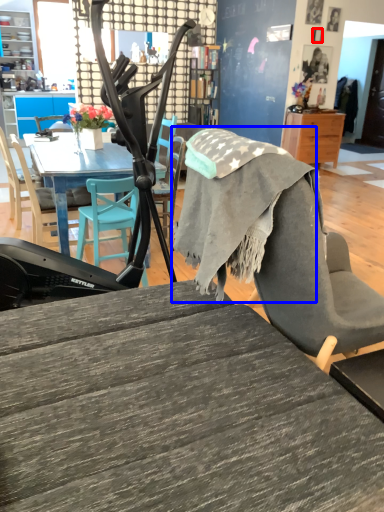
Question: Among these objects, which one is farthest to the camera, picture frame (highlighted by a red box) or fabric (highlighted by a blue box)?

Choices:
 (A) picture frame
 (B) fabric

Answer: (A)